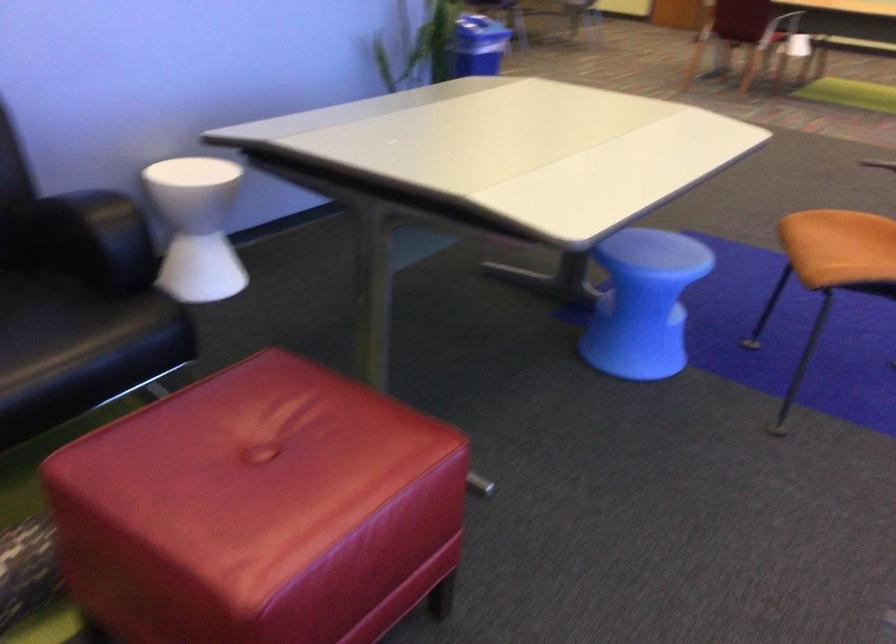
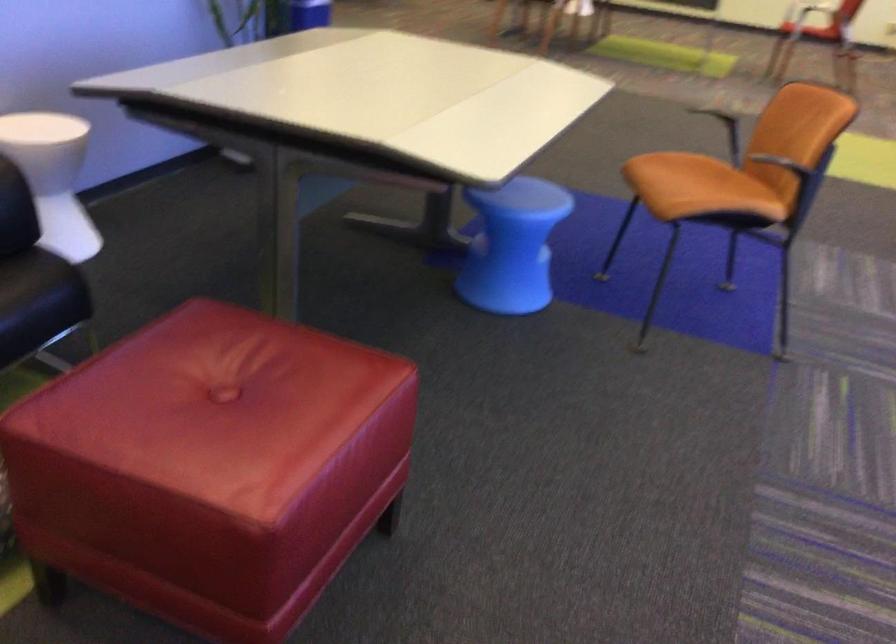
In the second image, find the point that corresponds to the point at 636,305 in the first image.

(512, 245)